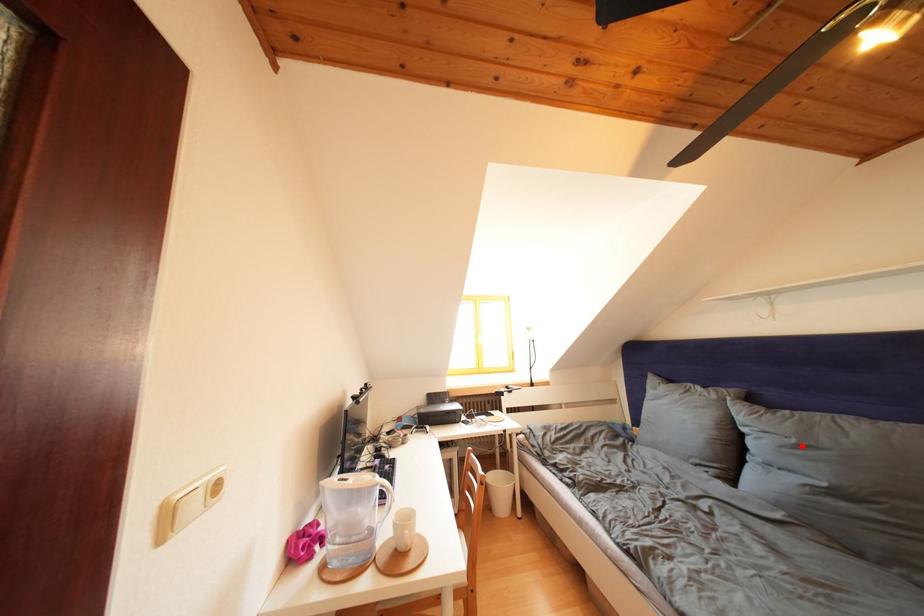
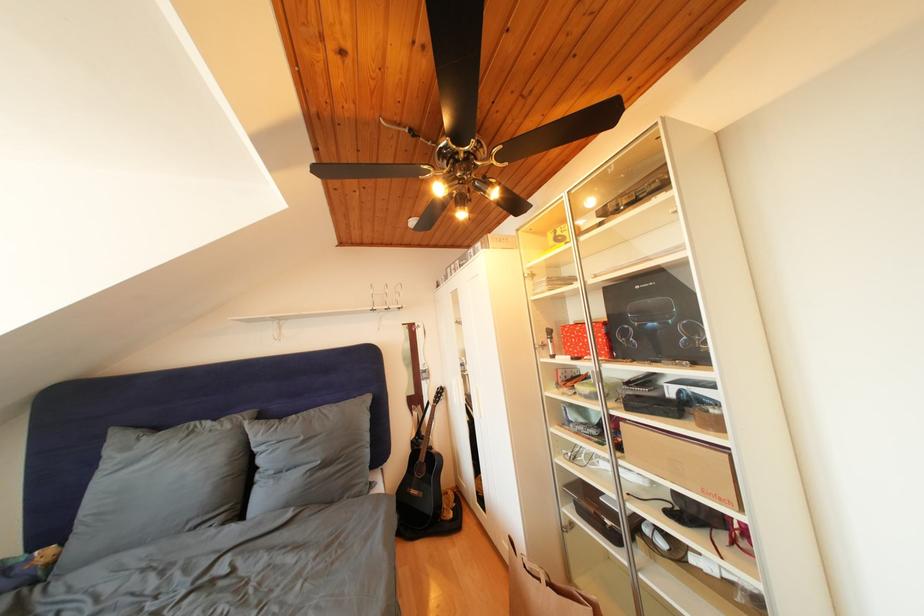
Locate, in the second image, the point that corresponds to the highlighted location in the first image.

(310, 444)